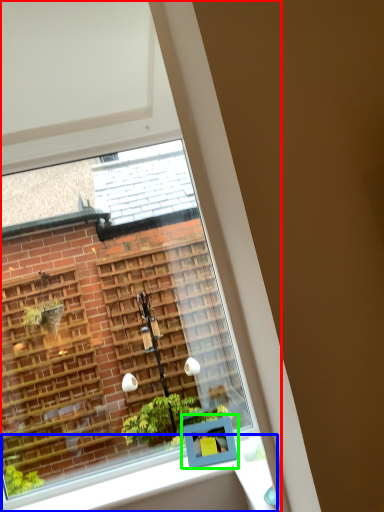
Question: Considering the real-world distances, which object is farthest from window (highlighted by a red box)? window sill (highlighted by a blue box) or window box (highlighted by a green box)?

Choices:
 (A) window sill
 (B) window box

Answer: (B)